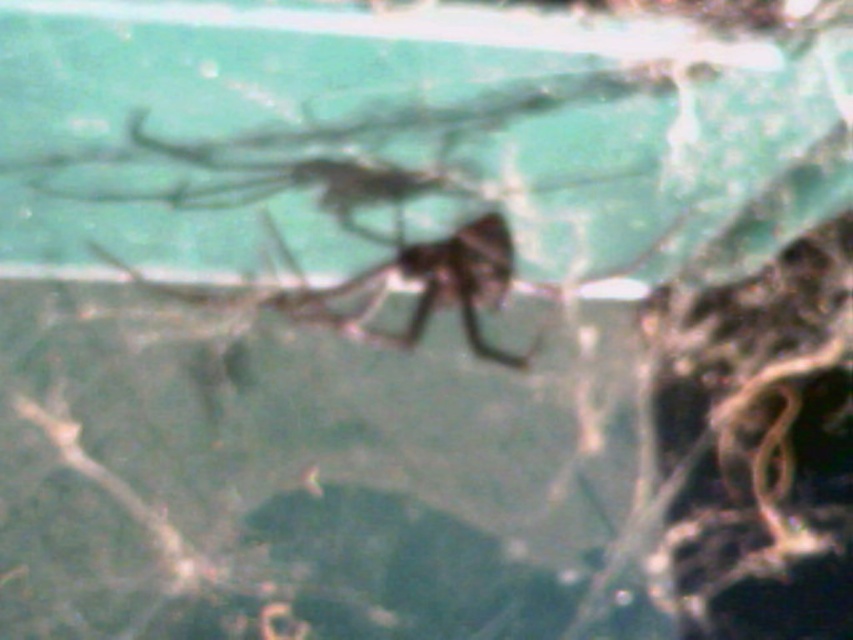
Does shiny black spider at center appear over shiny brown spider at center?

Yes, shiny black spider at center is above shiny brown spider at center.

Between shiny black spider at center and shiny brown spider at center, which one is positioned lower?

A: shiny brown spider at center is below.

Describe the element at coordinates (380, 204) in the screenshot. I see `shiny black spider at center` at that location.

The width and height of the screenshot is (853, 640). Find the location of `shiny black spider at center`. shiny black spider at center is located at coordinates (380, 204).